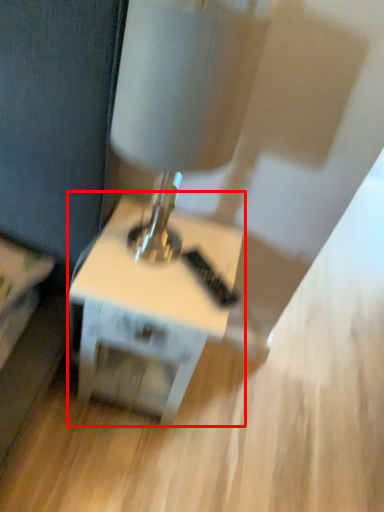
Question: From the image's perspective, where is table (annotated by the red box) located relative to table lamp?

Choices:
 (A) below
 (B) above

Answer: (A)